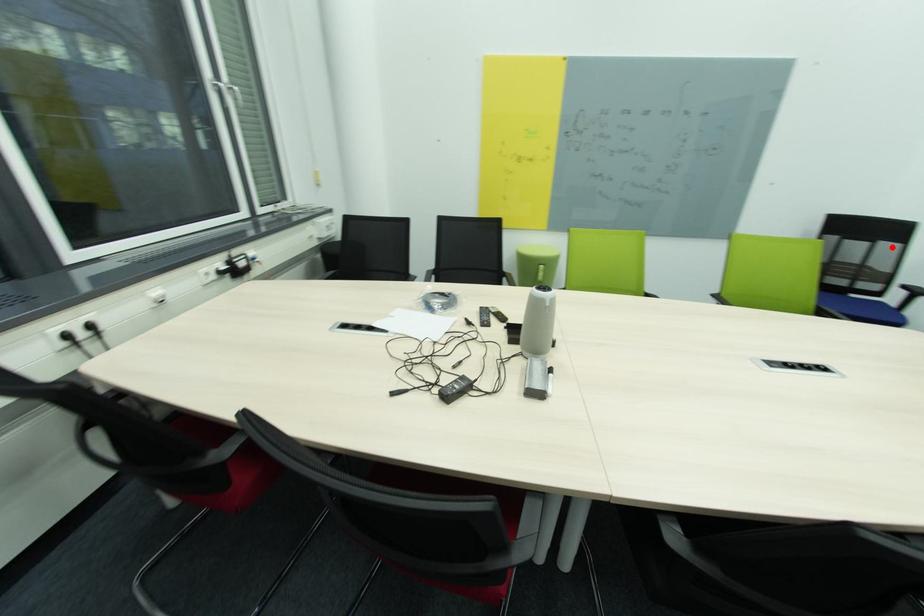
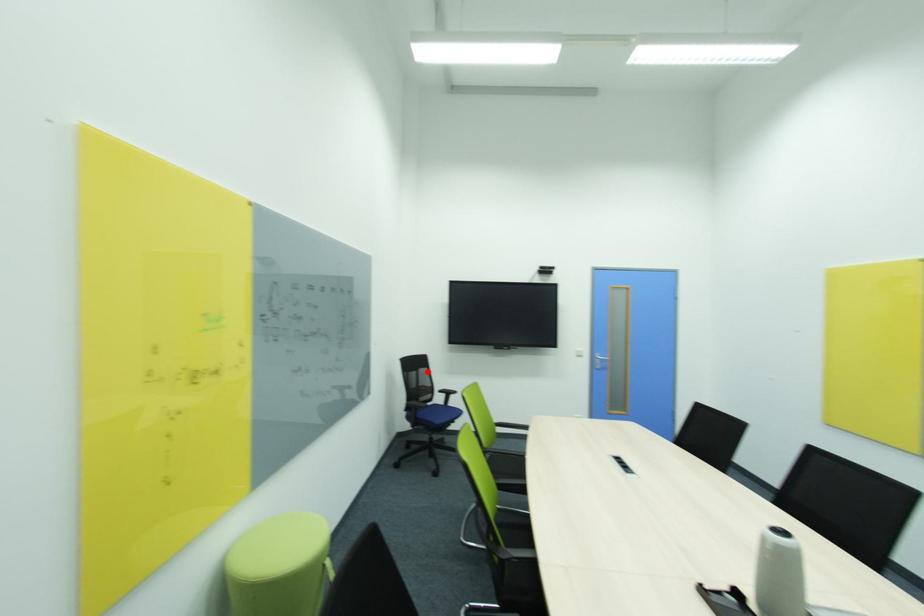
I am providing you with two images of the same scene from different viewpoints. A red point is marked on the first image and another point is marked on the second image. Is the red point in image1 aligned with the point shown in image2?

Yes